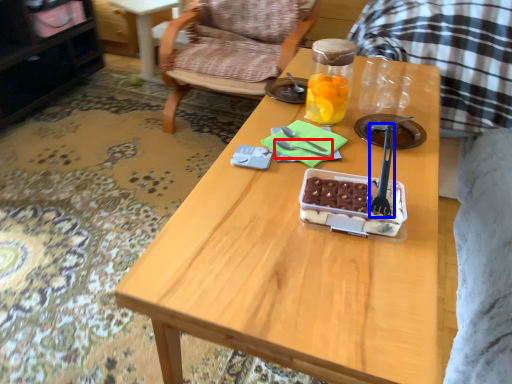
Question: Among these objects, which one is farthest to the camera, fork (highlighted by a red box) or fork (highlighted by a blue box)?

Choices:
 (A) fork
 (B) fork

Answer: (A)